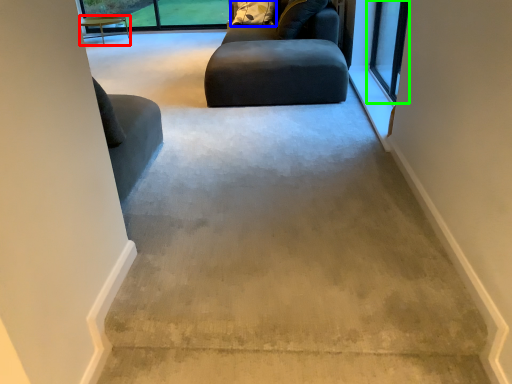
Question: Which is nearer to the table (highlighted by a red box)? pillow (highlighted by a blue box) or window (highlighted by a green box).

Choices:
 (A) pillow
 (B) window

Answer: (A)